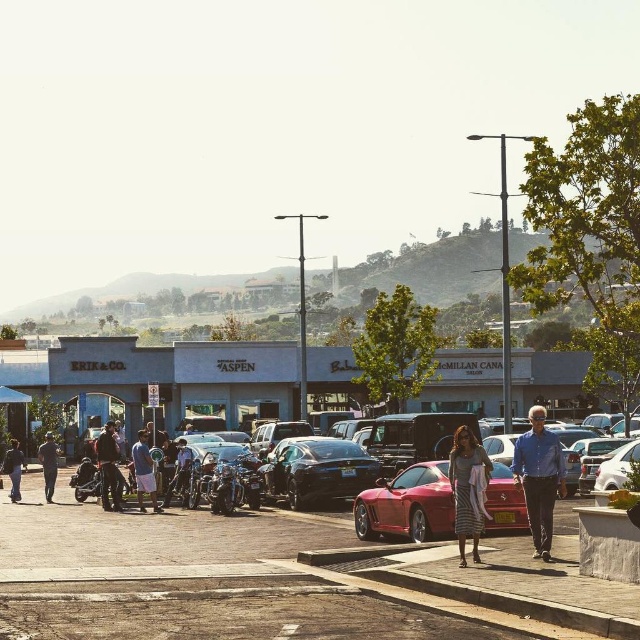
You are standing at the edge of the parking lot and want to reach the shiny metallic car at center and the blue shirt at center. Which object is closer to you?

The shiny metallic car at center is 6.26 meters away from blue shirt at center. Since you are at the edge of the parking lot, the blue shirt at center is closer to you than the shiny metallic car at center.

You are standing on the sidewalk at the shopping center and see both the shiny red sports car at center and the denim pants at center. Which object is positioned to the right of the other?

The shiny red sports car at center is to the right of denim pants at center.